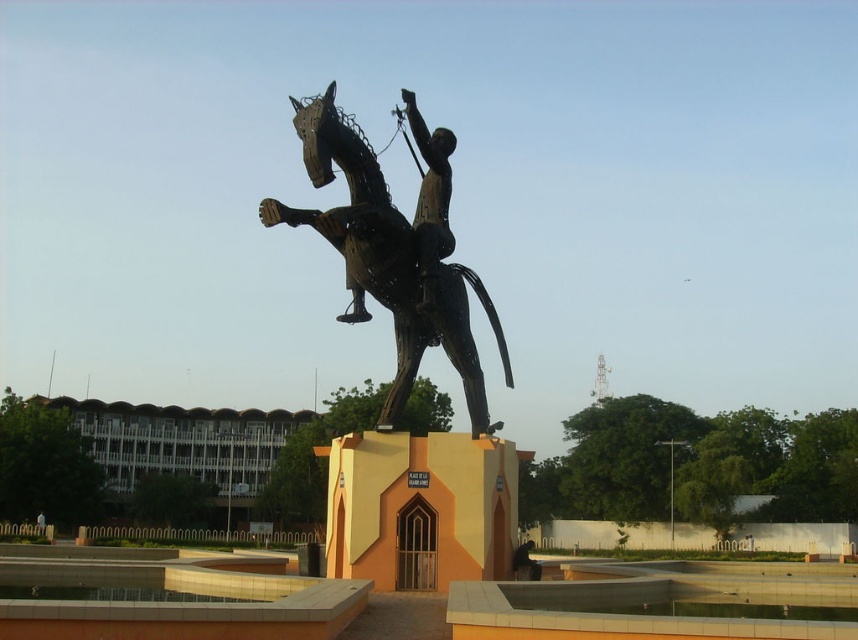
Can you confirm if black metal horseman at center is taller than polished bronze rider at center?

Yes.

Who is higher up, black metal horseman at center or polished bronze rider at center?

Positioned higher is polished bronze rider at center.

Is point (382, 257) more distant than point (429, 177)?

No, it is in front of (429, 177).

This screenshot has width=858, height=640. I want to click on black metal horseman at center, so click(x=396, y=250).